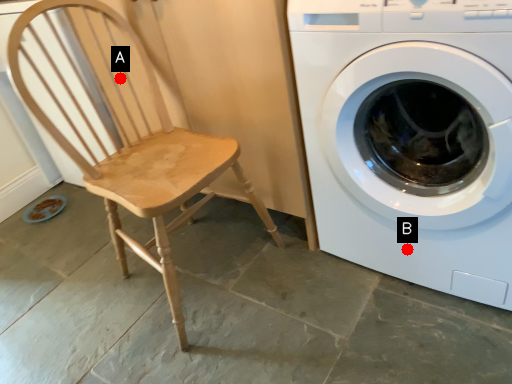
Question: Two points are circled on the image, labeled by A and B beside each circle. Among these points, which one is farthest from the camera?

Choices:
 (A) A is further
 (B) B is further

Answer: (A)